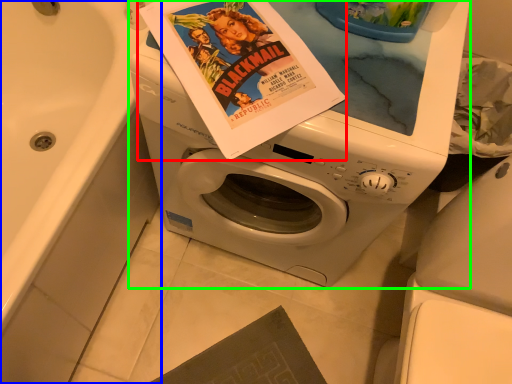
Question: Based on their relative distances, which object is nearer to paperback book (highlighted by a red box)? Choose from bath (highlighted by a blue box) and washing machine (highlighted by a green box).

Choices:
 (A) bath
 (B) washing machine

Answer: (B)